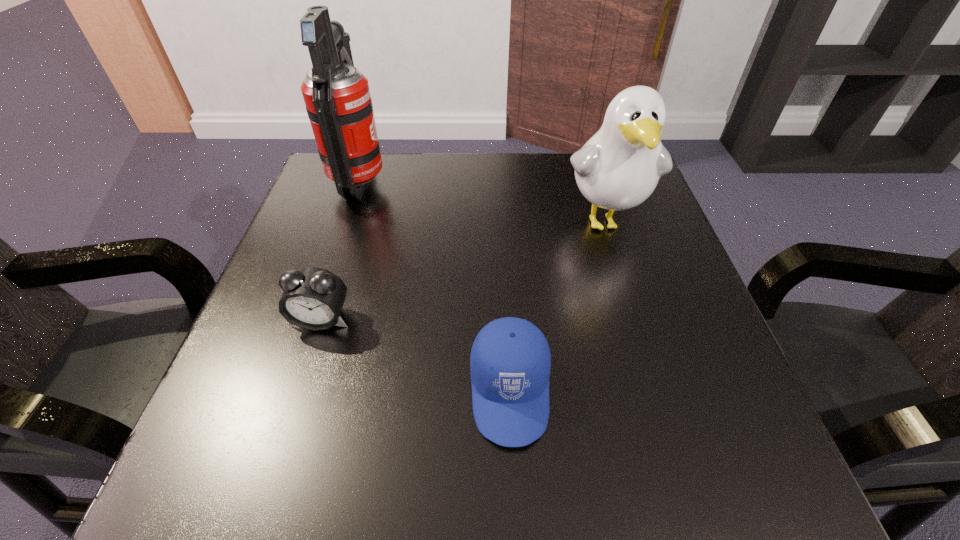
This screenshot has width=960, height=540. What are the coordinates of `gull that is positioned at the far edge` in the screenshot? It's located at (618, 168).

Where is `object present at the near edge`? Image resolution: width=960 pixels, height=540 pixels. object present at the near edge is located at coordinates (510, 361).

At what (x,y) coordinates should I click in order to perform the action: click on fire extinguisher located at the left edge. Please return your answer as a coordinate pair (x, y). Looking at the image, I should click on (337, 97).

The width and height of the screenshot is (960, 540). What are the coordinates of `alarm clock that is at the left edge` in the screenshot? It's located at (313, 298).

I want to click on object present at the right edge, so click(618, 168).

Identify the location of object located at the far left corner. (337, 97).

Identify the location of object present at the far right corner. The image size is (960, 540). (618, 168).

In the image, there is a desktop. Identify the location of blank space at the far edge. (508, 174).

Where is `free location at the near edge of the desktop`? free location at the near edge of the desktop is located at coordinates (527, 497).

In the image, there is a desktop. Where is `free space at the left edge`? This screenshot has height=540, width=960. free space at the left edge is located at coordinates point(244,386).